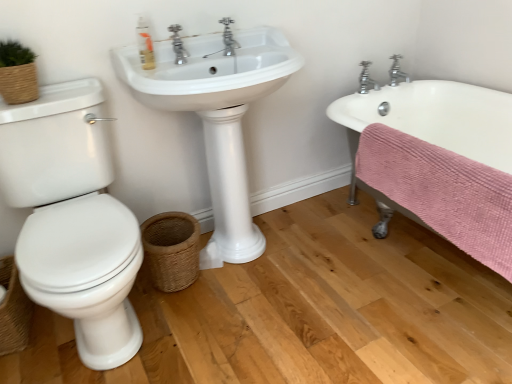
Question: From the image's perspective, does silver metallic faucet at upper right, which ranks as the 2th tap in back-to-front order, appear lower than chrome metallic faucet at upper center, which is the third tap from back to front?

Choices:
 (A) no
 (B) yes

Answer: (B)

Question: Can you confirm if silver metallic faucet at upper right, which appears as the 2th tap when viewed from the right, is wider than chrome metallic faucet at upper center, which is the first tap in front-to-back order?

Choices:
 (A) yes
 (B) no

Answer: (A)

Question: Does silver metallic faucet at upper right, which ranks as the 2th tap in back-to-front order, appear on the right side of chrome metallic faucet at upper center, acting as the first tap starting from the left?

Choices:
 (A) yes
 (B) no

Answer: (A)

Question: Could you tell me if silver metallic faucet at upper right, arranged as the second tap when viewed from the left, is turned towards chrome metallic faucet at upper center, which is the first tap in front-to-back order?

Choices:
 (A) yes
 (B) no

Answer: (B)

Question: Does silver metallic faucet at upper right, which is counted as the second tap, starting from the front, come behind chrome metallic faucet at upper center, which is the third tap from back to front?

Choices:
 (A) yes
 (B) no

Answer: (A)

Question: Does silver metallic faucet at upper right, which appears as the 2th tap when viewed from the right, have a greater height compared to chrome metallic faucet at upper center, which is the third tap from back to front?

Choices:
 (A) yes
 (B) no

Answer: (B)

Question: Considering the relative sizes of chrome metallic faucet at upper right, which appears as the 3th tap when viewed from the front, and chrome metallic faucet at upper center, acting as the first tap starting from the left, in the image provided, is chrome metallic faucet at upper right, which appears as the 3th tap when viewed from the front, wider than chrome metallic faucet at upper center, acting as the first tap starting from the left,?

Choices:
 (A) yes
 (B) no

Answer: (A)

Question: Considering the relative positions of chrome metallic faucet at upper right, arranged as the first tap when viewed from the right, and chrome metallic faucet at upper center, acting as the first tap starting from the left, in the image provided, is chrome metallic faucet at upper right, arranged as the first tap when viewed from the right, in front of chrome metallic faucet at upper center, acting as the first tap starting from the left,?

Choices:
 (A) no
 (B) yes

Answer: (A)

Question: Considering the relative sizes of chrome metallic faucet at upper right, which is counted as the 3th tap, starting from the left, and chrome metallic faucet at upper center, the 3th tap when ordered from right to left, in the image provided, is chrome metallic faucet at upper right, which is counted as the 3th tap, starting from the left, thinner than chrome metallic faucet at upper center, the 3th tap when ordered from right to left,?

Choices:
 (A) yes
 (B) no

Answer: (B)

Question: Considering the relative sizes of chrome metallic faucet at upper right, arranged as the first tap when viewed from the right, and chrome metallic faucet at upper center, the 3th tap when ordered from right to left, in the image provided, is chrome metallic faucet at upper right, arranged as the first tap when viewed from the right, shorter than chrome metallic faucet at upper center, the 3th tap when ordered from right to left,?

Choices:
 (A) no
 (B) yes

Answer: (B)

Question: Is chrome metallic faucet at upper right, the 1th tap positioned from the back, directly adjacent to chrome metallic faucet at upper center, the 3th tap when ordered from right to left?

Choices:
 (A) no
 (B) yes

Answer: (A)

Question: From a real-world perspective, is chrome metallic faucet at upper right, which appears as the 3th tap when viewed from the front, over chrome metallic faucet at upper center, which is the first tap in front-to-back order?

Choices:
 (A) no
 (B) yes

Answer: (A)

Question: Is white glossy sink at center turned away from pink textured towel at lower right?

Choices:
 (A) yes
 (B) no

Answer: (B)